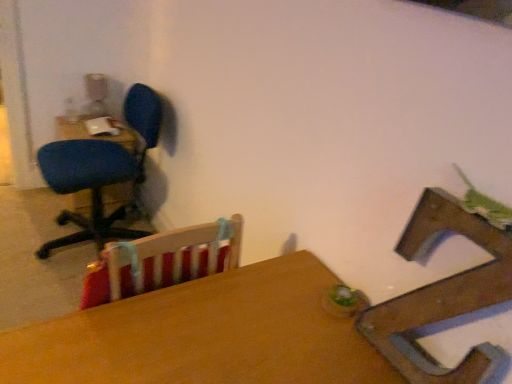
Question: From the image's perspective, is blue fabric office chair at left, which is the 2th chair from front to back, above or below matte blue chair at left, the 1th table viewed from the back?

Choices:
 (A) below
 (B) above

Answer: (A)

Question: Considering the positions of blue fabric office chair at left, the 1th chair when ordered from back to front, and matte blue chair at left, the 1th table viewed from the back, in the image, is blue fabric office chair at left, the 1th chair when ordered from back to front, taller or shorter than matte blue chair at left, the 1th table viewed from the back,?

Choices:
 (A) short
 (B) tall

Answer: (B)

Question: Which object is the farthest from the wooden table at center, which is the second table from back to front?

Choices:
 (A) matte blue chair at left, marked as the second table in a bottom-to-top arrangement
 (B) blue fabric office chair at left, the 2th chair viewed from the right
 (C) wooden chair at center, which appears as the 1th chair when viewed from the front

Answer: (A)

Question: Which is nearer to the blue fabric office chair at left, the 2th chair viewed from the right?

Choices:
 (A) matte blue chair at left, the 1th table when ordered from top to bottom
 (B) wooden table at center, the first table when ordered from right to left
 (C) wooden chair at center, which appears as the 1th chair when viewed from the front

Answer: (A)